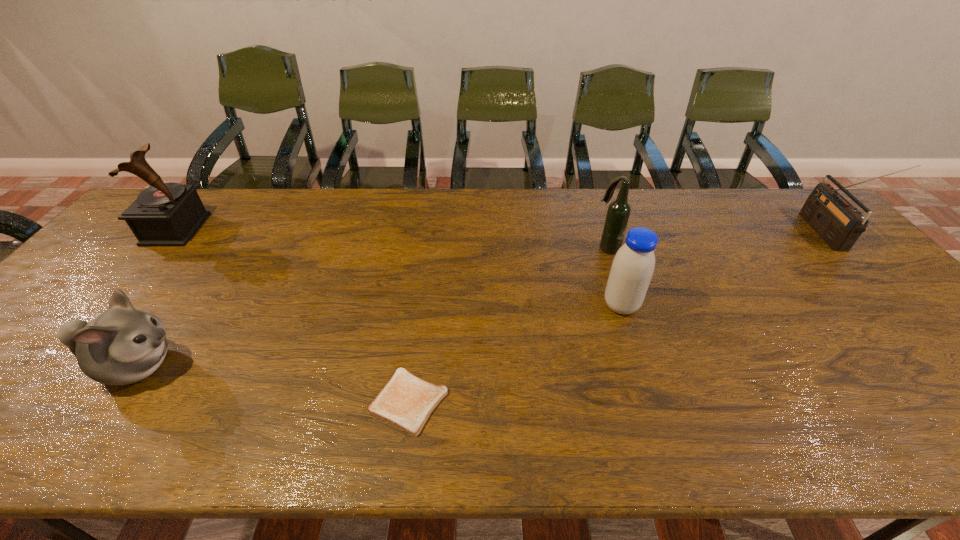
At what (x,y) coordinates should I click in order to perform the action: click on the rightmost object. Please return your answer as a coordinate pair (x, y). Looking at the image, I should click on (839, 224).

Find the location of a particular element. phonograph_record is located at coordinates (165, 214).

What are the coordinates of `beer bottle` in the screenshot? It's located at (618, 213).

Where is `soya milk`? This screenshot has height=540, width=960. soya milk is located at coordinates (633, 265).

The image size is (960, 540). I want to click on the second shortest object, so click(121, 346).

Where is `toast`? The image size is (960, 540). toast is located at coordinates coord(406,402).

Locate an element on the screen. the shortest object is located at coordinates (406, 402).

Image resolution: width=960 pixels, height=540 pixels. I want to click on blank area located on the front-facing side of the rightmost object, so click(x=693, y=233).

Where is `vacant space located on the front-facing side of the rightmost object`? vacant space located on the front-facing side of the rightmost object is located at coordinates (777, 233).

Identify the location of free location located on the front-facing side of the rightmost object. This screenshot has width=960, height=540. (719, 233).